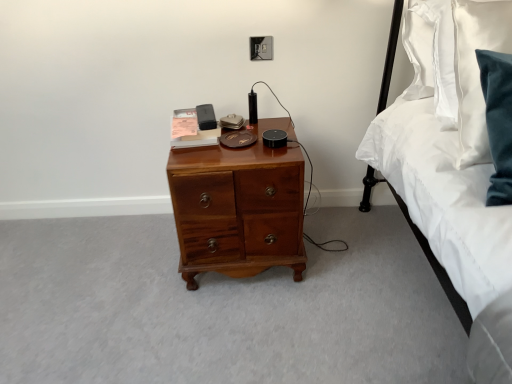
Image resolution: width=512 pixels, height=384 pixels. Identify the location of vacant space to the right of shiny brown wooden chest of drawers at center. (345, 254).